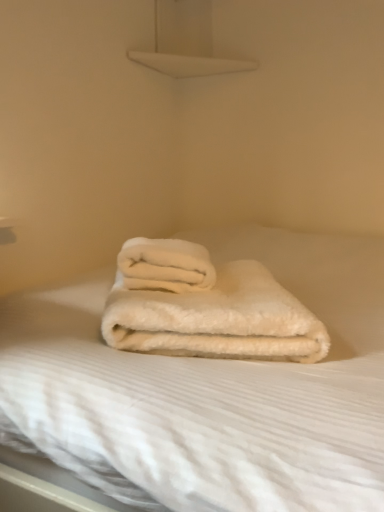
Locate an element on the screen. Image resolution: width=384 pixels, height=512 pixels. vacant space that is to the left of white fluffy towel at center, the 2th towel positioned from the bottom is located at coordinates [x=70, y=287].